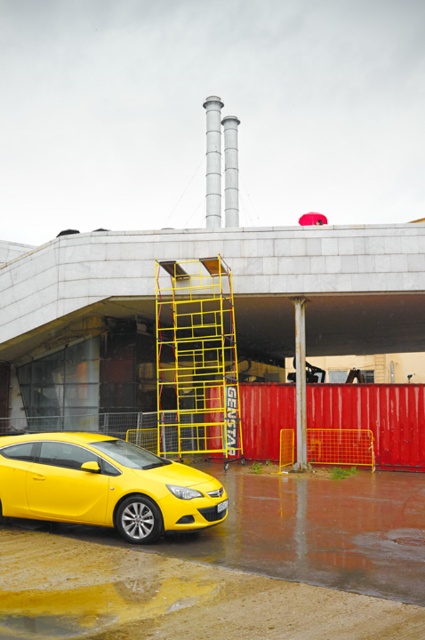
Question: Considering the relative positions of shiny yellow car at lower left and yellow metal ladder at center in the image provided, where is shiny yellow car at lower left located with respect to yellow metal ladder at center?

Choices:
 (A) above
 (B) below

Answer: (B)

Question: Can you confirm if shiny yellow car at lower left is positioned to the right of yellow metal ladder at center?

Choices:
 (A) yes
 (B) no

Answer: (B)

Question: Is shiny yellow car at lower left smaller than yellow metal ladder at center?

Choices:
 (A) no
 (B) yes

Answer: (B)